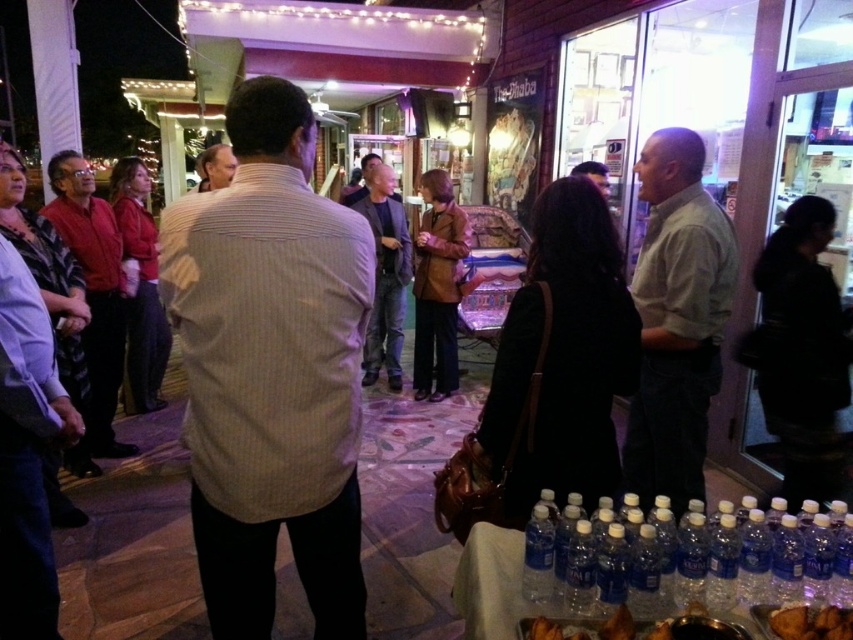
Can you confirm if clear plastic bottles at lower right is positioned above red shirt at left?

No.

Does clear plastic bottles at lower right appear under red shirt at left?

Correct, clear plastic bottles at lower right is located below red shirt at left.

Does point (693, 509) come farther from viewer compared to point (93, 374)?

No, (693, 509) is closer to viewer.

Locate an element on the screen. This screenshot has width=853, height=640. clear plastic bottles at lower right is located at coordinates (741, 561).

Describe the element at coordinates (386, 275) in the screenshot. This screenshot has width=853, height=640. I see `dark gray jeans at center` at that location.

This screenshot has height=640, width=853. I want to click on dark gray jeans at center, so click(x=386, y=275).

You are a GUI agent. You are given a task and a screenshot of the screen. Output one action in this format:
    pyautogui.click(x=<x>, y=<y>)
    Task: Click on the red shirt at left
    
    Given the screenshot: What is the action you would take?
    pyautogui.click(x=93, y=300)

Does red shirt at left have a greater width compared to dark gray jeans at center?

Yes, red shirt at left is wider than dark gray jeans at center.

Locate an element on the screen. red shirt at left is located at coordinates (93, 300).